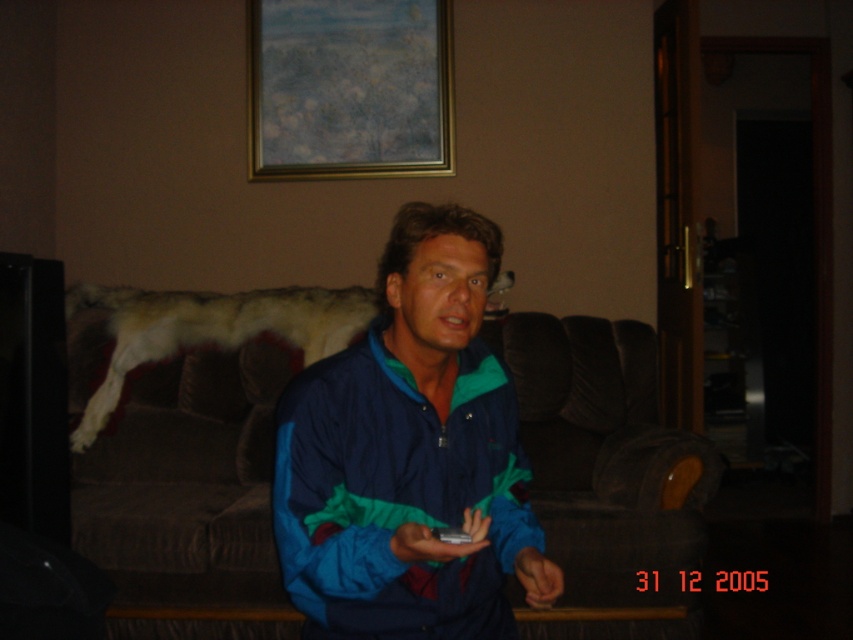
Does brown fabric couch at center have a larger size compared to black plastic remote at center?

Correct, brown fabric couch at center is larger in size than black plastic remote at center.

This screenshot has height=640, width=853. What do you see at coordinates (189, 497) in the screenshot?
I see `brown fabric couch at center` at bounding box center [189, 497].

Is point (618, 397) more distant than point (440, 540)?

Yes, point (618, 397) is behind point (440, 540).

Where is `brown fabric couch at center`? brown fabric couch at center is located at coordinates [189, 497].

Does brown fabric couch at center have a greater height compared to white fur coat at upper left?

Yes.

Which is more to the right, brown fabric couch at center or white fur coat at upper left?

brown fabric couch at center is more to the right.

Find the location of a particular element. This screenshot has width=853, height=640. brown fabric couch at center is located at coordinates (189, 497).

Does point (311, 570) come behind point (451, 531)?

Yes, point (311, 570) is farther from viewer.

Which is below, blue/green fabric jacket at center or black plastic remote at center?

Positioned lower is black plastic remote at center.

Is point (425, 528) behind point (444, 538)?

No.

Where is `blue/green fabric jacket at center`? blue/green fabric jacket at center is located at coordinates (410, 456).